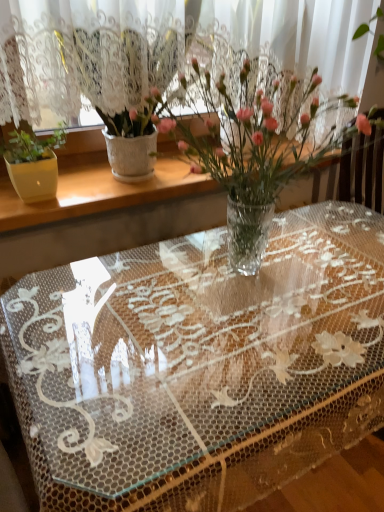
In order to click on free location in front of clear plastic vase at center, the 2th houseplant viewed from the left in this screenshot , I will do `click(216, 386)`.